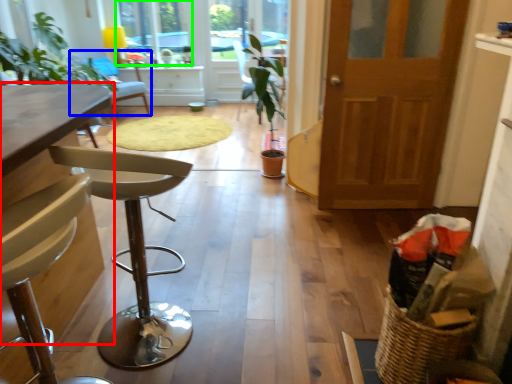
Question: Considering the real-world distances, which object is closest to table (highlighted by a red box)? chair (highlighted by a blue box) or window (highlighted by a green box).

Choices:
 (A) chair
 (B) window

Answer: (A)